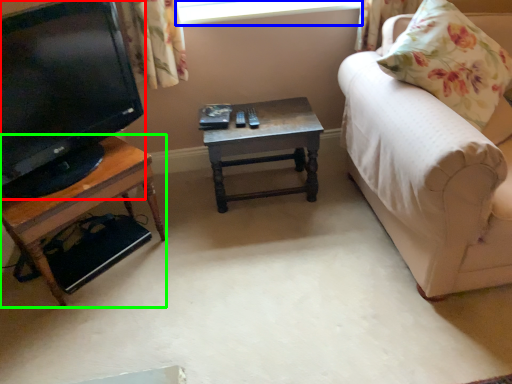
Question: Considering the real-world distances, which object is closest to television (highlighted by a red box)? window screen (highlighted by a blue box) or table (highlighted by a green box).

Choices:
 (A) window screen
 (B) table

Answer: (B)